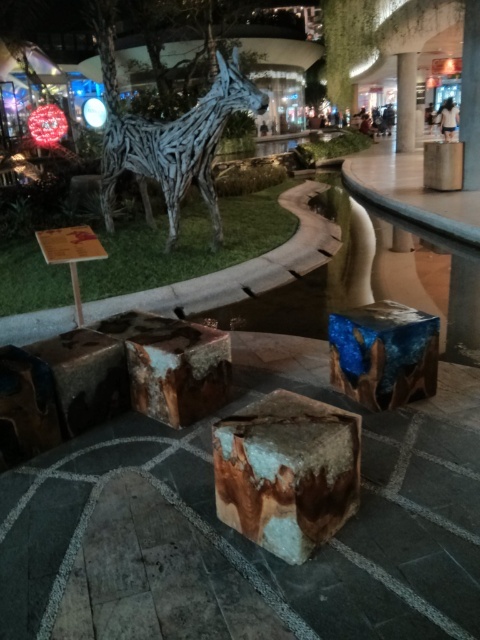
Question: Is blue resin cube at center positioned behind blue resin cube at upper right?

Choices:
 (A) no
 (B) yes

Answer: (A)

Question: Can you confirm if blue resin cube at center is wider than blue resin cube at upper right?

Choices:
 (A) yes
 (B) no

Answer: (A)

Question: Which point is closer to the camera taking this photo?

Choices:
 (A) (191, 109)
 (B) (414, 333)
 (C) (294, 465)

Answer: (C)

Question: Which is farther from the rustic wood stump at center?

Choices:
 (A) blue resin cube at upper right
 (B) smooth concrete pillar at upper right
 (C) blue resin cube at center

Answer: (B)

Question: Can you confirm if wooden sculpture at center is wider than brown wood stump at center?

Choices:
 (A) no
 (B) yes

Answer: (B)

Question: Which object appears farthest from the camera in this image?

Choices:
 (A) wooden sculpture at center
 (B) brown wood stump at center
 (C) blue resin cube at upper right

Answer: (C)